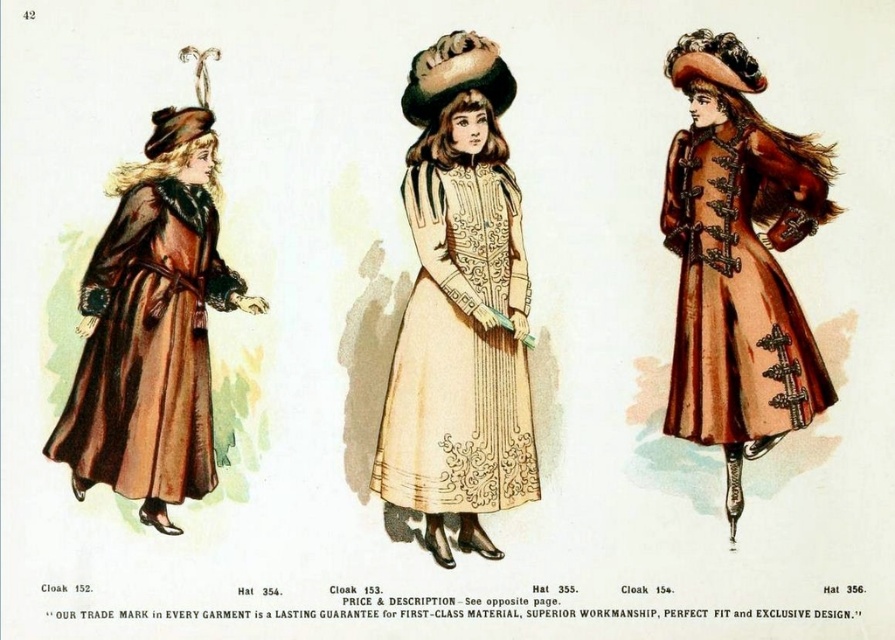
Looking at this image, what is the color of the object at point (738, 260)?

The object at point (738, 260) is matte brown coat at center.

You are a tailor measuring garments for alterations. You have a beige embroidered dress at center and a brown fur coat at left. Which garment has a smaller width that needs to be adjusted?

The beige embroidered dress at center has a smaller width than the brown fur coat at left, so it is the garment that needs adjustment if the smaller width is an issue.